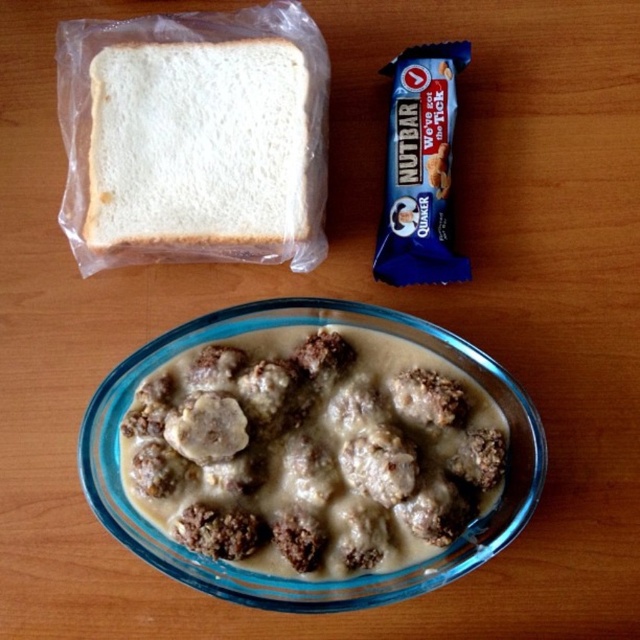
You are a chef arranging ingredients on a wooden surface. You have the brown crumbly meatballs at center and the white matte bread at upper left. Which item is placed higher up on the surface?

The white matte bread at upper left is placed higher up on the wooden surface because the brown crumbly meatballs at center are positioned under it.

Based on the photo, you are a chef inspecting the meal arrangement on the wooden surface. You need to adjust the placement of the brown crumbly meatballs at center and the blue wrapper bar at upper right so that the bar is closer to you than the meatballs. Is this possible without moving any other items?

The brown crumbly meatballs at center are currently closer to the viewer than the blue wrapper bar at upper right. To make the bar closer, you would need to move the meatballs further back, but since the question specifies not moving other items, it is not possible to achieve the desired arrangement without moving the meatballs.

Looking at this image, you are arranging items on a shelf and need to stack the brown crumbly meatballs at center and the blue wrapper bar at upper right vertically. Which item should you place at the bottom to ensure stability?

The blue wrapper bar at upper right should be placed at the bottom since it is taller than the brown crumbly meatballs at center, providing a stable base.